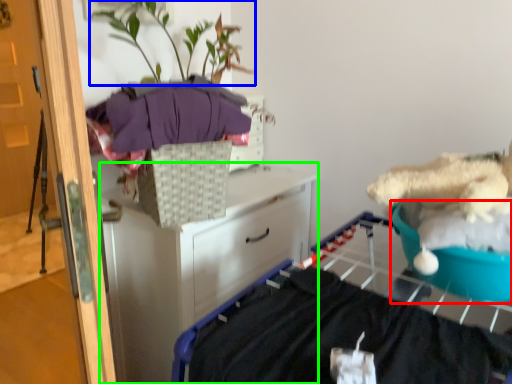
Question: Based on their relative distances, which object is farther from teal (highlighted by a red box)? Choose from plant (highlighted by a blue box) and chest of drawers (highlighted by a green box).

Choices:
 (A) plant
 (B) chest of drawers

Answer: (A)